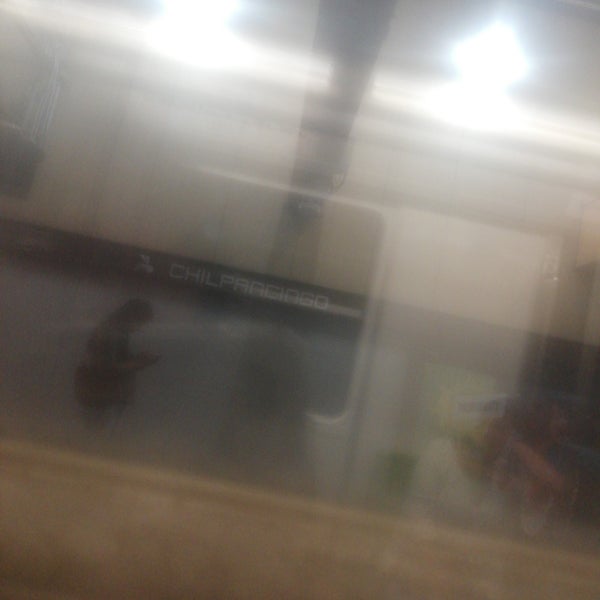
Where is `tile`? tile is located at coordinates click(220, 213).